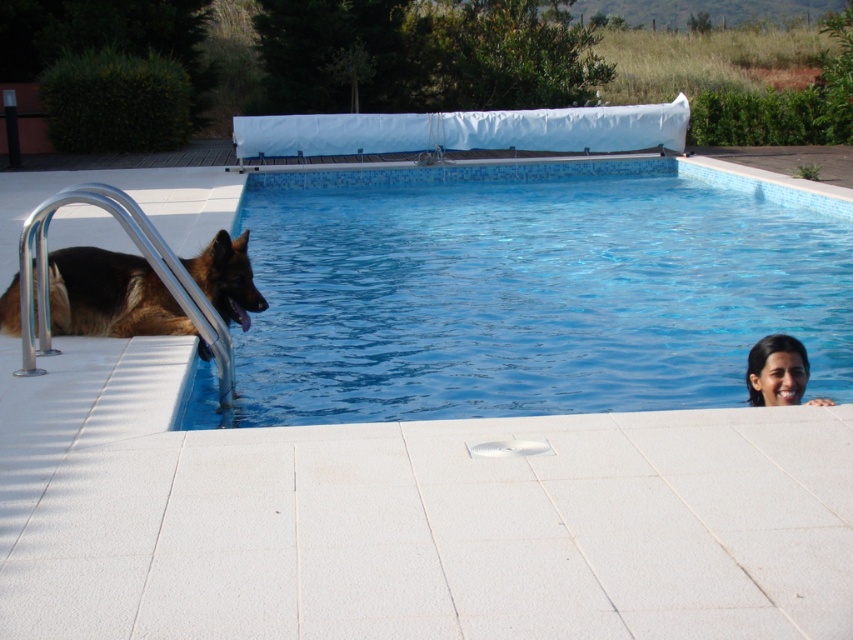
You are planning to host a small gathering and need to know if the brown fur dog at left can comfortably lie entirely within the blue tile pool at center without any part of it sticking out. Based on the scene description, can it fit?

The blue tile pool at center has a larger size compared to the brown fur dog at left, so the dog can comfortably lie entirely within the pool without any part sticking out.

You are a photographer trying to capture a photo of the brown fur dog at left and the smooth skin face at upper right. Since you want both subjects to be in focus, you need to know their positions relative to each other. Which object is positioned more to the left side of the image?

The brown fur dog at left is positioned more to the left side of the image than the smooth skin face at upper right.

You are a photographer trying to capture a clear shot of the smooth skin face at upper right and the blue tile pool at center. However, the pool cover is blocking your view. Can you adjust your position to see both objects without moving the pool cover?

The smooth skin face at upper right is behind the blue tile pool at center, so if you move your camera position to the side of the blue tile pool at center, you can see both the smooth skin face at upper right and the blue tile pool at center without moving the pool cover.